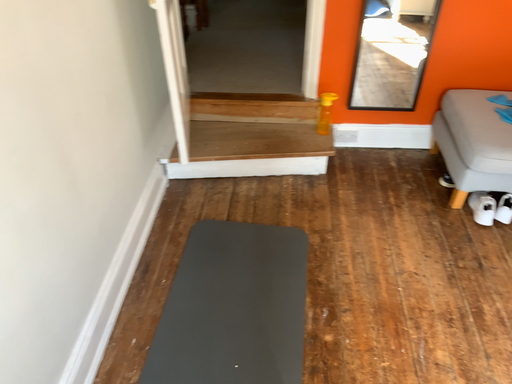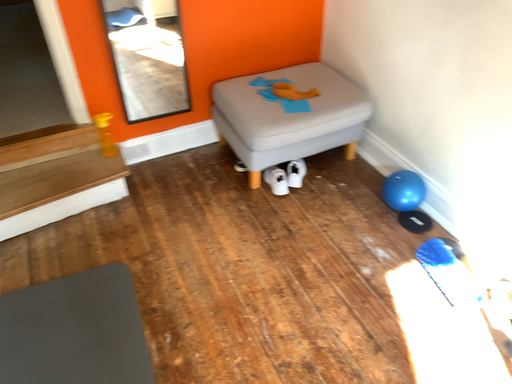
Question: Which way did the camera rotate in the video?

Choices:
 (A) rotated left
 (B) rotated right

Answer: (B)